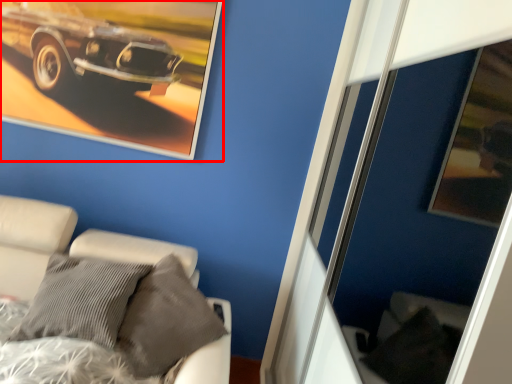
Question: From the image's perspective, considering the relative positions of picture frame (annotated by the red box) and furniture in the image provided, where is picture frame (annotated by the red box) located with respect to the staircase?

Choices:
 (A) below
 (B) above

Answer: (B)